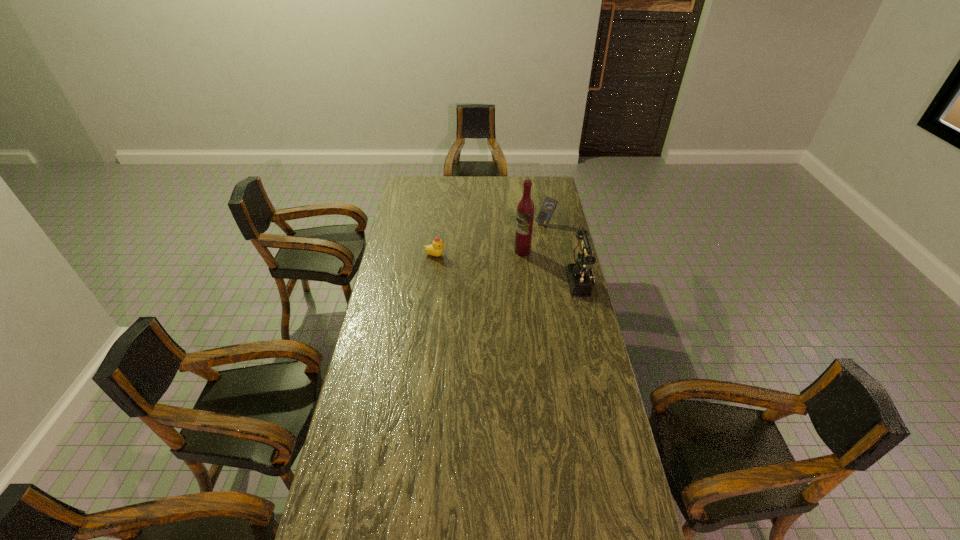
This screenshot has height=540, width=960. I want to click on vacant space at the far left corner of the desktop, so click(426, 179).

This screenshot has width=960, height=540. What are the coordinates of `free space between the duckling and the third tallest object` in the screenshot? It's located at (491, 239).

Where is `vacant area that lies between the second tallest object and the leftmost object`? vacant area that lies between the second tallest object and the leftmost object is located at coordinates (508, 268).

Image resolution: width=960 pixels, height=540 pixels. What are the coordinates of `empty space between the calculator and the duckling` in the screenshot? It's located at pyautogui.click(x=491, y=239).

You are a GUI agent. You are given a task and a screenshot of the screen. Output one action in this format:
    pyautogui.click(x=<x>, y=<y>)
    Task: Click on the vacant area between the liquor and the third tallest object
    The width and height of the screenshot is (960, 540).
    Given the screenshot: What is the action you would take?
    pyautogui.click(x=534, y=237)

In order to click on unoccupied position between the tallest object and the telephone in this screenshot , I will do `click(551, 266)`.

I want to click on empty space that is in between the shortest object and the second shortest object, so click(491, 239).

Where is `vacant region between the shortest object and the calculator`? vacant region between the shortest object and the calculator is located at coordinates (491, 239).

The height and width of the screenshot is (540, 960). Identify the location of vacant point located between the leftmost object and the calculator. (491, 239).

Where is `free space between the liquor and the third shortest object`? free space between the liquor and the third shortest object is located at coordinates (551, 266).